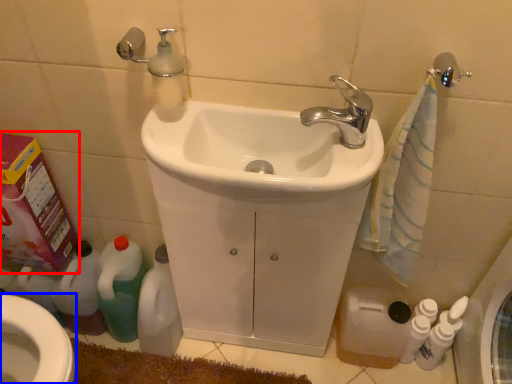
Question: Which point is further to the camera, carton (highlighted by a red box) or bidet (highlighted by a blue box)?

Choices:
 (A) carton
 (B) bidet

Answer: (B)